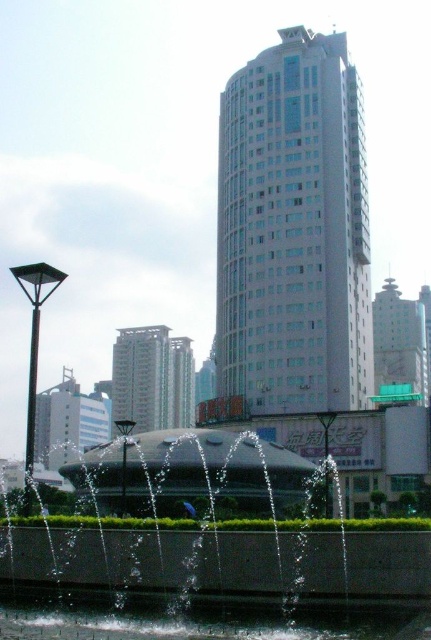
You are a photographer standing in the urban scene. You want to capture a photo of the concrete fountain at center and the clear water at fountain center. Which object will appear larger in the photo?

The concrete fountain at center will appear larger in the photo because it is closer to the photographer than the clear water at fountain center, which is behind it.

You are standing at the point marked as point (x=181, y=541) in the urban scene. What object are you standing on?

You are standing on the concrete fountain at center located at point (x=181, y=541).